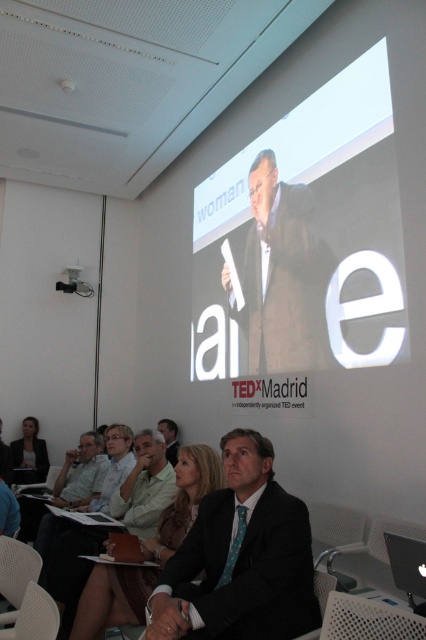
Between metallic silver chair at lower right and dark gray suit at lower left, which one is positioned higher?

metallic silver chair at lower right is higher up.

Is metallic silver chair at lower right wider than dark gray suit at lower left?

Incorrect, metallic silver chair at lower right's width does not surpass dark gray suit at lower left's.

Which is behind, point (324, 509) or point (43, 476)?

The point (43, 476) is behind.

This screenshot has height=640, width=426. What are the coordinates of `metallic silver chair at lower right` in the screenshot? It's located at (334, 528).

Is metallic silver chair at lower right below dark brown suit at center?

Indeed, metallic silver chair at lower right is positioned under dark brown suit at center.

Does point (337, 513) come farther from viewer compared to point (173, 442)?

That is False.

Who is more distant from viewer, (331, 513) or (170, 458)?

The point (170, 458) is more distant.

This screenshot has height=640, width=426. I want to click on metallic silver chair at lower right, so click(334, 528).

Is white mesh chair at lower center smaller than dark brown suit at center?

Correct, white mesh chair at lower center occupies less space than dark brown suit at center.

How much distance is there between white mesh chair at lower center and dark brown suit at center?

A distance of 3.54 meters exists between white mesh chair at lower center and dark brown suit at center.

Who is more distant from viewer, [328,627] or [164,420]?

The point [164,420] is more distant.

Locate an element on the screen. The image size is (426, 640). white mesh chair at lower center is located at coordinates (368, 620).